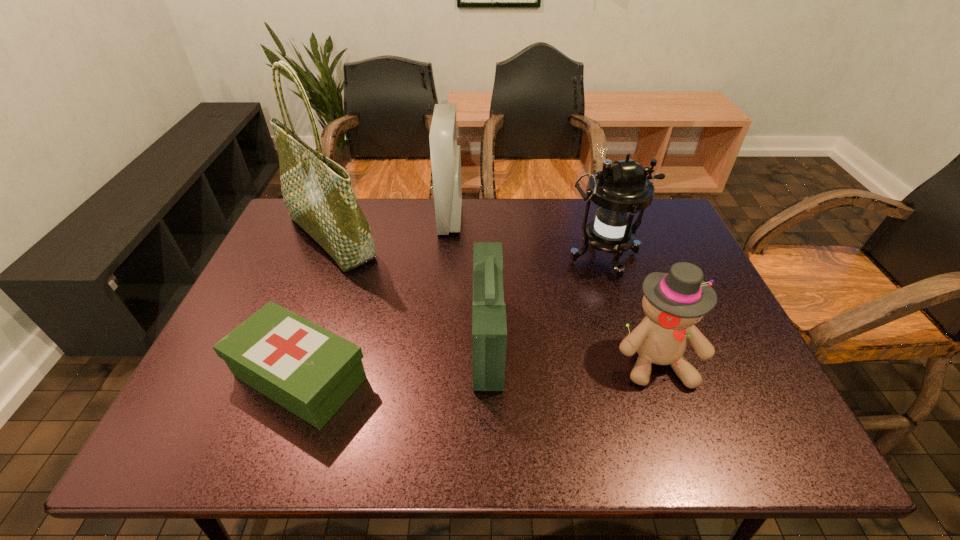
Find the location of a particular element. The width and height of the screenshot is (960, 540). the tallest object is located at coordinates (317, 192).

At what (x,y) coordinates should I click in order to perform the action: click on the fourth object from right to left. Please return your answer as a coordinate pair (x, y). Looking at the image, I should click on (445, 153).

Find the location of `the tallest first-aid kit`. the tallest first-aid kit is located at coordinates (445, 153).

Where is `lantern`? The height and width of the screenshot is (540, 960). lantern is located at coordinates (620, 190).

In order to click on rag_doll in this screenshot , I will do `click(673, 302)`.

I want to click on the third object from right to left, so click(x=489, y=326).

You are a GUI agent. You are given a task and a screenshot of the screen. Output one action in this format:
    pyautogui.click(x=<x>, y=<y>)
    Task: Click on the fifth tallest object
    This screenshot has height=540, width=960.
    Given the screenshot: What is the action you would take?
    pyautogui.click(x=489, y=326)

Find the location of a particular element. the leftmost first-aid kit is located at coordinates (310, 371).

I want to click on the shortest first-aid kit, so pos(310,371).

The height and width of the screenshot is (540, 960). Identify the location of vacant space located on the front of the tallest object. (285, 354).